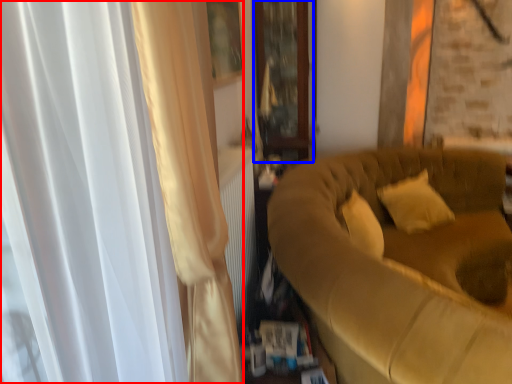
Question: Which object appears farthest to the camera in this image, curtain (highlighted by a red box) or glass door (highlighted by a blue box)?

Choices:
 (A) curtain
 (B) glass door

Answer: (B)